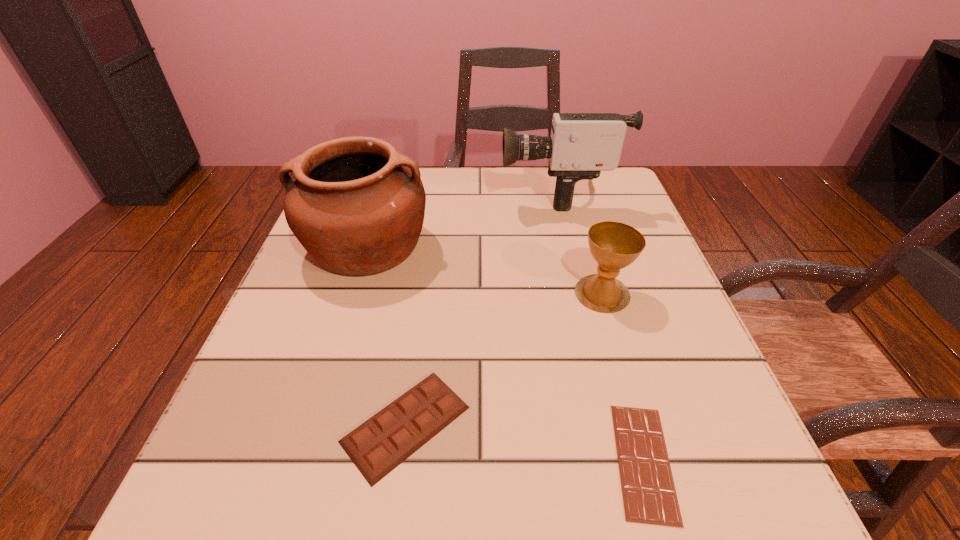
Locate an element on the screen. Image resolution: width=960 pixels, height=540 pixels. vacant space that satisfies the following two spatial constraints: 1. on the back side of the shorter chocolate bar; 2. on the recording direction of the camcorder is located at coordinates (568, 193).

Identify the location of vacant space that satisfies the following two spatial constraints: 1. on the recording direction of the camcorder; 2. on the front side of the left chocolate bar. This screenshot has height=540, width=960. (614, 424).

In order to click on free spot that satisfies the following two spatial constraints: 1. on the recording direction of the camcorder; 2. on the front side of the taller chocolate bar in this screenshot , I will do `click(614, 424)`.

The height and width of the screenshot is (540, 960). Find the location of `vacant area that satisfies the following two spatial constraints: 1. on the front side of the third tallest object; 2. on the left side of the pottery`. vacant area that satisfies the following two spatial constraints: 1. on the front side of the third tallest object; 2. on the left side of the pottery is located at coordinates (352, 293).